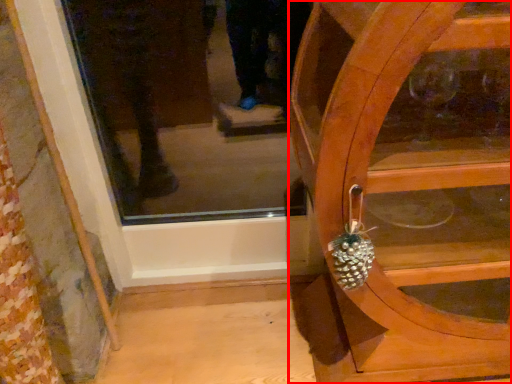
Question: From the image's perspective, what is the correct spatial positioning of furniture (annotated by the red box) in reference to pineapple?

Choices:
 (A) above
 (B) below

Answer: (A)